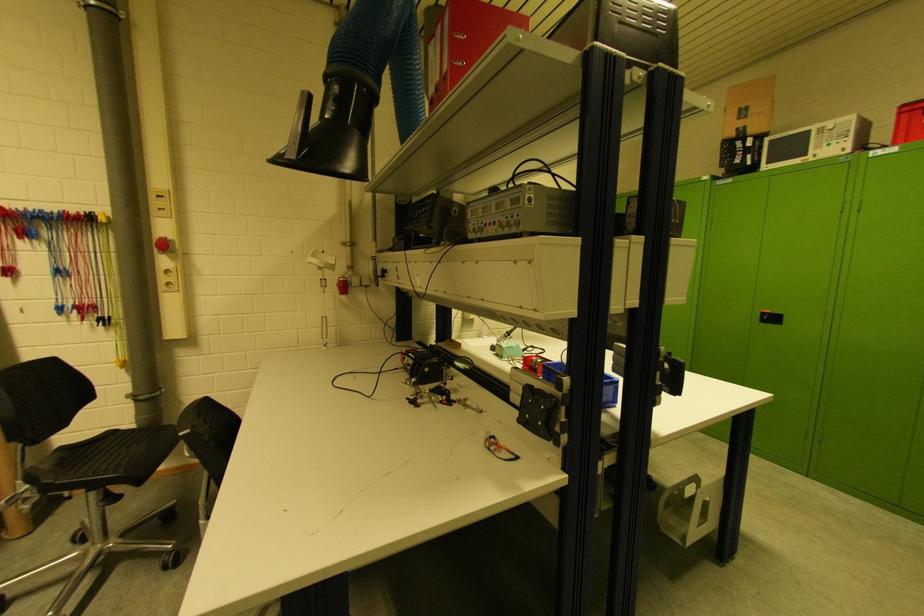
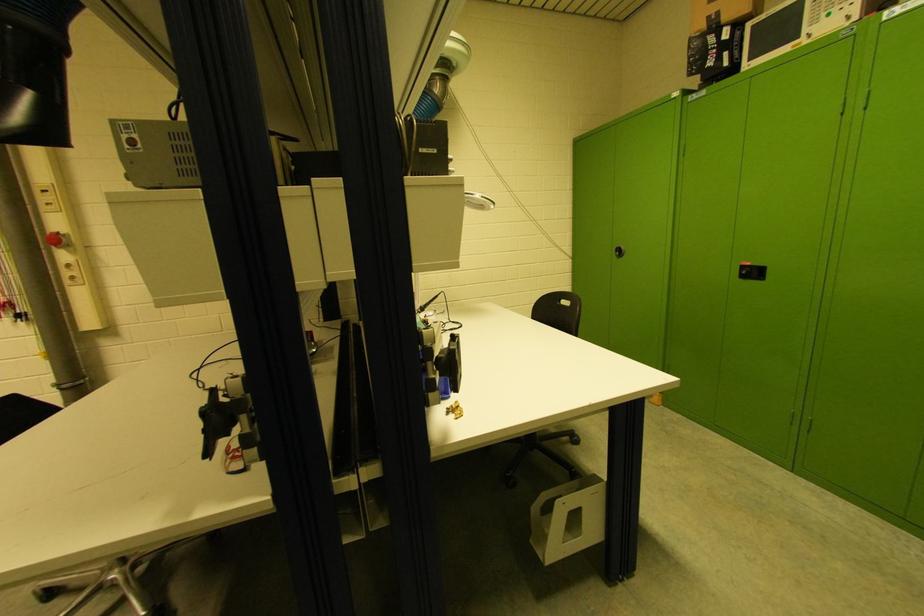
Which direction would the cameraman need to move to produce the second image?

The cameraman moved toward right, forward.